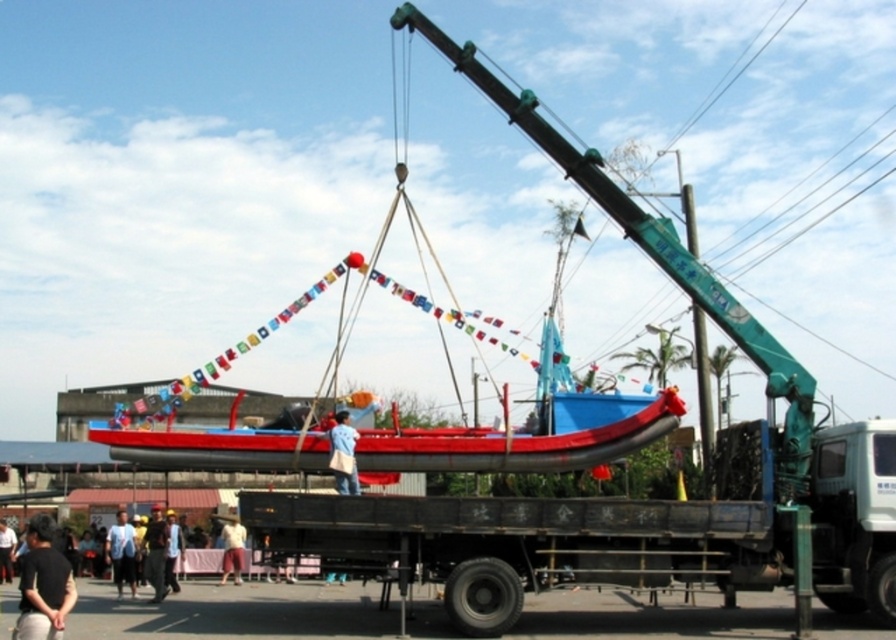
Which is below, light blue shirt at lower left or white cotton shirt at lower center?

white cotton shirt at lower center is below.

Who is more forward, (x=119, y=576) or (x=227, y=538)?

Positioned in front is point (x=119, y=576).

Which is behind, point (113, 572) or point (228, 545)?

Positioned behind is point (228, 545).

Find the location of `light blue shirt at lower left`. light blue shirt at lower left is located at coordinates (122, 552).

Consider the image. Between light blue shirt at lower left and dark blue shirt at lower left, which one is positioned higher?

light blue shirt at lower left

Between point (128, 541) and point (15, 540), which one is positioned in front?

Positioned in front is point (128, 541).

Locate an element on the screen. The image size is (896, 640). light blue shirt at lower left is located at coordinates (122, 552).

Who is taller, white cotton shirt at lower center or dark blue shirt at lower left?

With more height is white cotton shirt at lower center.

Between white cotton shirt at lower center and dark blue shirt at lower left, which one is positioned lower?

white cotton shirt at lower center is below.

Measure the distance between white cotton shirt at lower center and camera.

white cotton shirt at lower center is 90.76 meters from camera.

This screenshot has width=896, height=640. I want to click on white cotton shirt at lower center, so click(x=231, y=547).